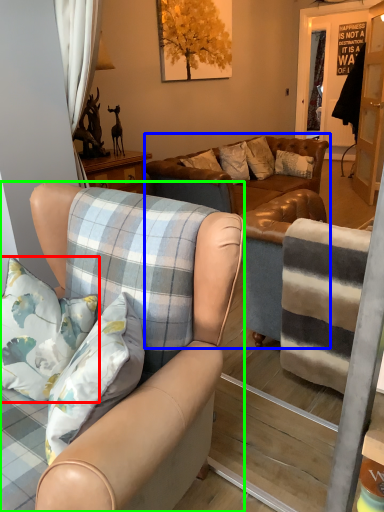
Question: Considering the real-world distances, which object is closest to pillow (highlighted by a red box)? studio couch (highlighted by a blue box) or chair (highlighted by a green box).

Choices:
 (A) studio couch
 (B) chair

Answer: (B)